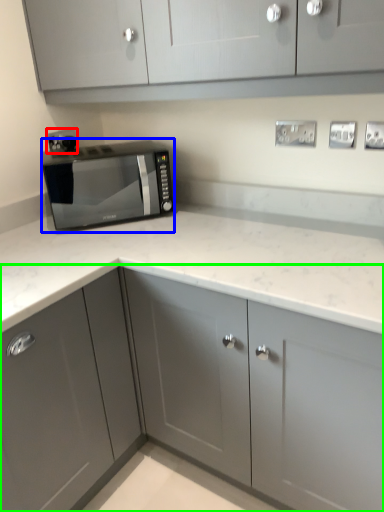
Question: Estimate the real-world distances between objects in this image. Which object is farther from electric outlet (highlighted by a red box), microwave oven (highlighted by a blue box) or cabinetry (highlighted by a green box)?

Choices:
 (A) microwave oven
 (B) cabinetry

Answer: (B)